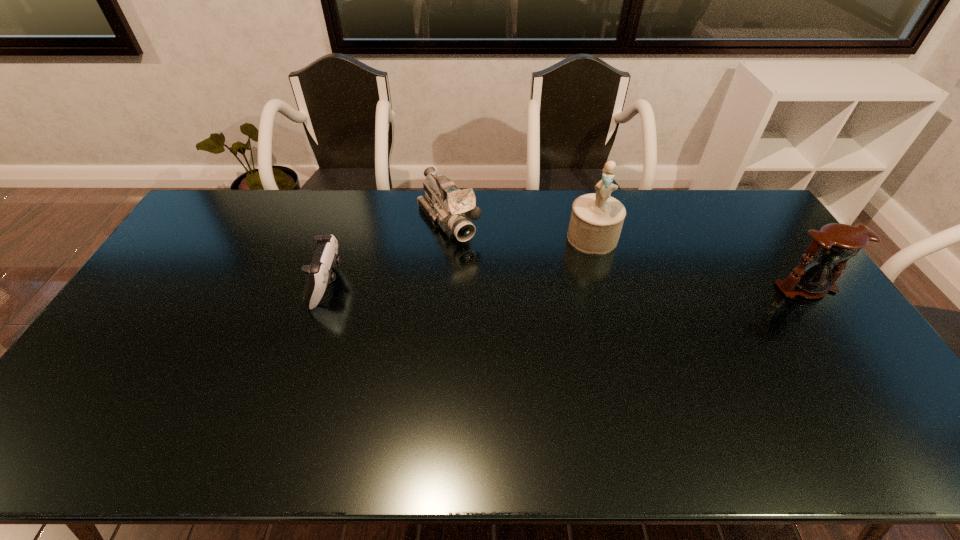
Locate an element on the screen. The image size is (960, 540). vacant spot on the desktop that is between the shortest object and the rightmost object and is positioned at the beak of the third object from left to right is located at coordinates (585, 286).

Locate an element on the screen. This screenshot has width=960, height=540. free space on the desktop that is between the shortest object and the hourglass and is positioned on the front-facing side of the second object from left to right is located at coordinates point(497,286).